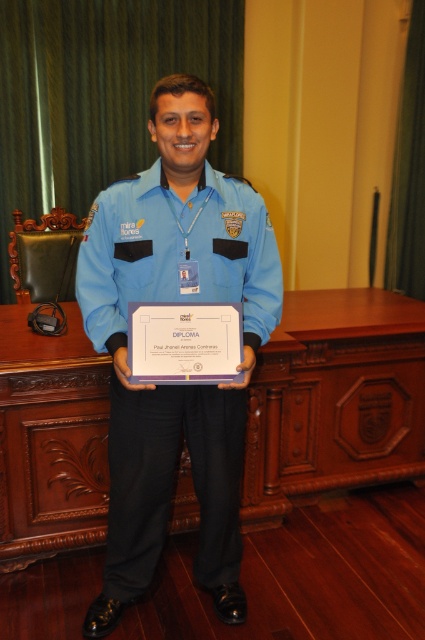
Based on the photo, is wooden at center closer to the viewer compared to blue fabric uniform at center?

No, wooden at center is further to the viewer.

Between point (53, 388) and point (238, 477), which one is positioned in front?

Point (238, 477) is more forward.

The height and width of the screenshot is (640, 425). I want to click on wooden at center, so click(x=334, y=400).